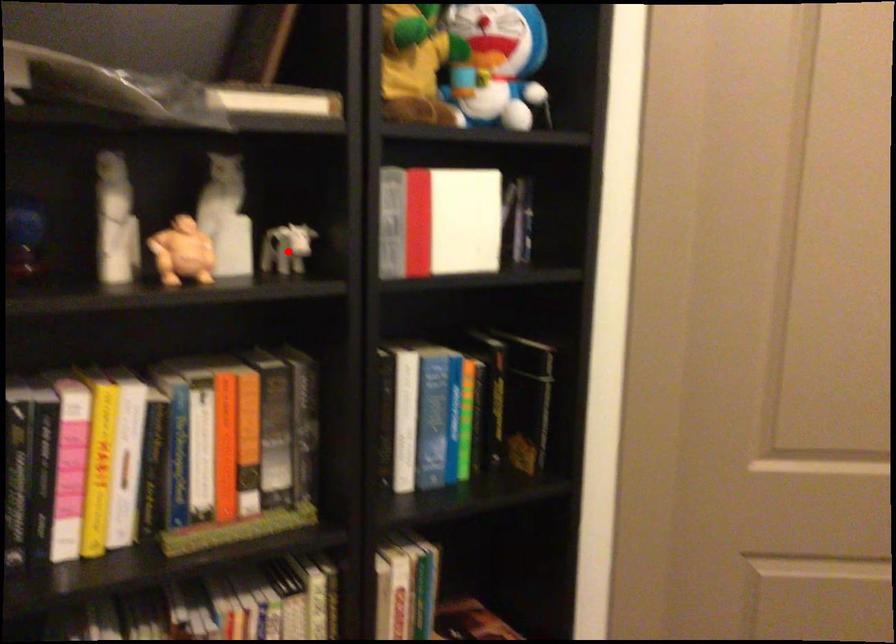
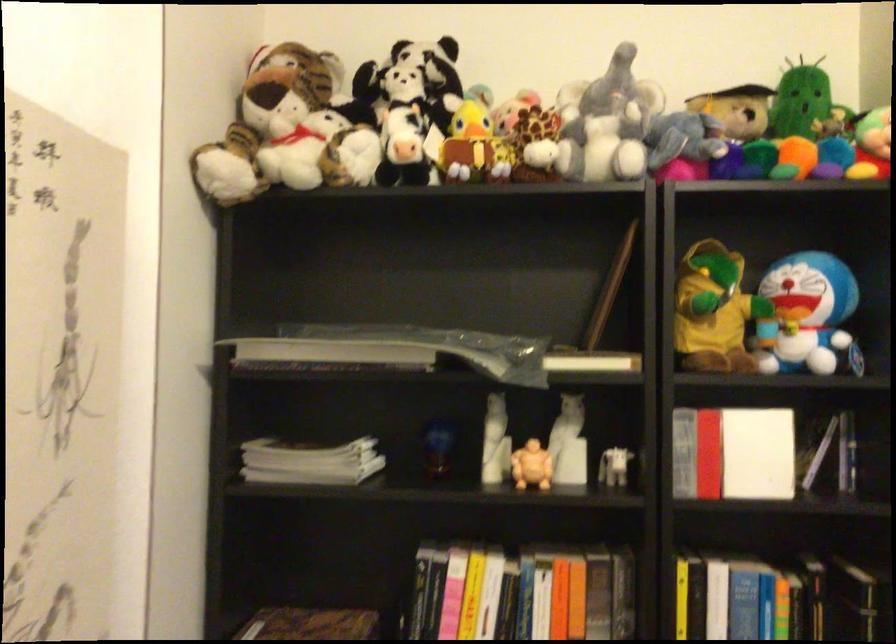
Question: I am providing you with two images of the same scene from different viewpoints. Given a red point in image1, look at the same physical point in image2. Is it:

Choices:
 (A) Closer to the viewpoint
 (B) Farther from the viewpoint

Answer: (B)